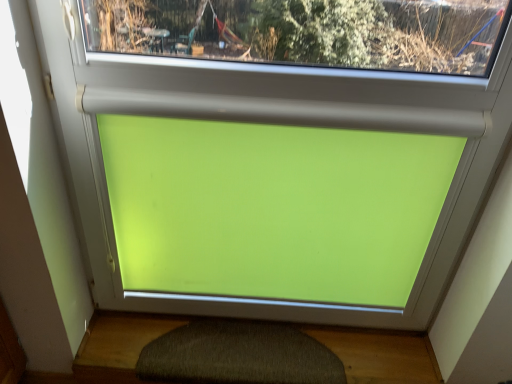
Question: Should I look upward or downward to see dark gray textured bath mat at bottom?

Choices:
 (A) up
 (B) down

Answer: (B)